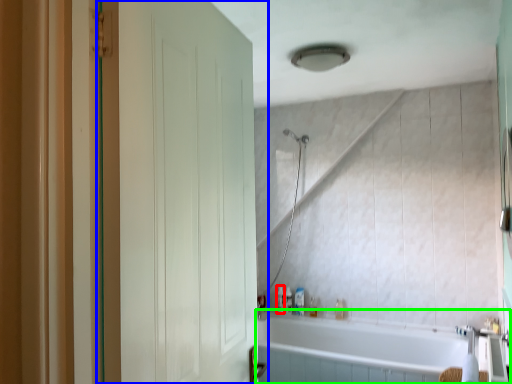
Question: Based on their relative distances, which object is farther from toiletry (highlighted by a red box)? Choose from door (highlighted by a blue box) and bathtub (highlighted by a green box).

Choices:
 (A) door
 (B) bathtub

Answer: (A)